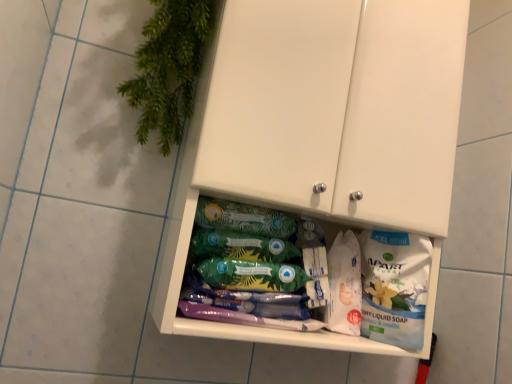
Describe the element at coordinates (322, 132) in the screenshot. I see `white matte cabinet at center` at that location.

Where is `white matte cabinet at center`? white matte cabinet at center is located at coordinates (322, 132).

The width and height of the screenshot is (512, 384). I want to click on white matte cabinet at center, so click(x=322, y=132).